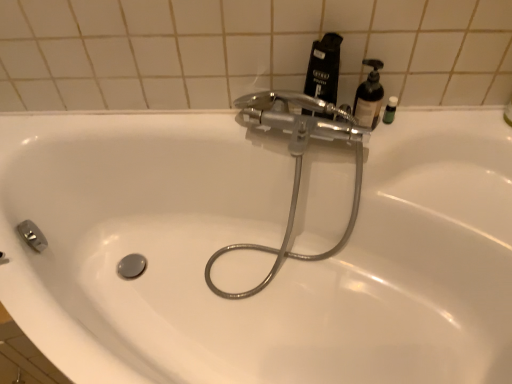
Question: Can you confirm if translucent plastic soap dispenser at upper right is taller than polished chrome faucet at upper center?

Choices:
 (A) no
 (B) yes

Answer: (A)

Question: Can you confirm if translucent plastic soap dispenser at upper right is bigger than polished chrome faucet at upper center?

Choices:
 (A) no
 (B) yes

Answer: (A)

Question: Is translucent plastic soap dispenser at upper right not near polished chrome faucet at upper center?

Choices:
 (A) no
 (B) yes

Answer: (A)

Question: From a real-world perspective, is translucent plastic soap dispenser at upper right over polished chrome faucet at upper center?

Choices:
 (A) no
 (B) yes

Answer: (B)

Question: From a real-world perspective, is translucent plastic soap dispenser at upper right beneath polished chrome faucet at upper center?

Choices:
 (A) no
 (B) yes

Answer: (A)

Question: From a real-world perspective, is translucent plastic soap dispenser at upper right above or below black matte bottle at upper right?

Choices:
 (A) above
 (B) below

Answer: (B)

Question: In the image, is translucent plastic soap dispenser at upper right on the left side or the right side of black matte bottle at upper right?

Choices:
 (A) left
 (B) right

Answer: (B)

Question: Considering their positions, is translucent plastic soap dispenser at upper right located in front of or behind black matte bottle at upper right?

Choices:
 (A) behind
 (B) front

Answer: (A)

Question: Is point (365, 94) closer or farther from the camera than point (311, 112)?

Choices:
 (A) closer
 (B) farther

Answer: (B)

Question: Which is correct: black matte bottle at upper right is inside polished chrome faucet at upper center, or outside of it?

Choices:
 (A) outside
 (B) inside

Answer: (A)

Question: From the image's perspective, relative to polished chrome faucet at upper center, is black matte bottle at upper right above or below?

Choices:
 (A) above
 (B) below

Answer: (A)

Question: Looking at the image, does black matte bottle at upper right seem bigger or smaller compared to polished chrome faucet at upper center?

Choices:
 (A) small
 (B) big

Answer: (A)

Question: Is black matte bottle at upper right to the left or to the right of polished chrome faucet at upper center in the image?

Choices:
 (A) right
 (B) left

Answer: (A)

Question: Based on their sizes in the image, would you say green matte bottle at upper right is bigger or smaller than translucent plastic soap dispenser at upper right?

Choices:
 (A) small
 (B) big

Answer: (A)

Question: Do you think green matte bottle at upper right is within translucent plastic soap dispenser at upper right, or outside of it?

Choices:
 (A) outside
 (B) inside

Answer: (A)